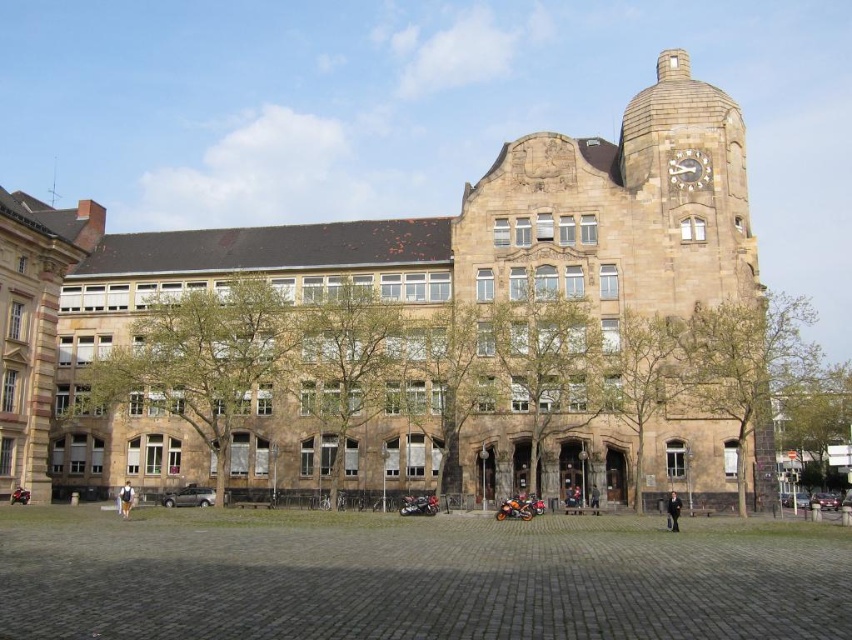
What is the spatial relationship between the silver metallic clock at upper center and the brown leather jacket at lower left?

The silver metallic clock at upper center is positioned above the brown leather jacket at lower left.

You are a delivery person standing at the entrance of the building and need to locate the dark brown leather jacket at lower right. Which direction should you move relative to the silver metallic clock at upper center to find it?

The dark brown leather jacket at lower right is located to the left of the silver metallic clock at upper center, so you should move to the left relative to the clock to find it.

You are standing in front of the historic building and want to locate the point at coordinates (688, 193). Based on the scene description, where is this point located?

The point at coordinates (688, 193) is on the brown stone clock tower at upper right.